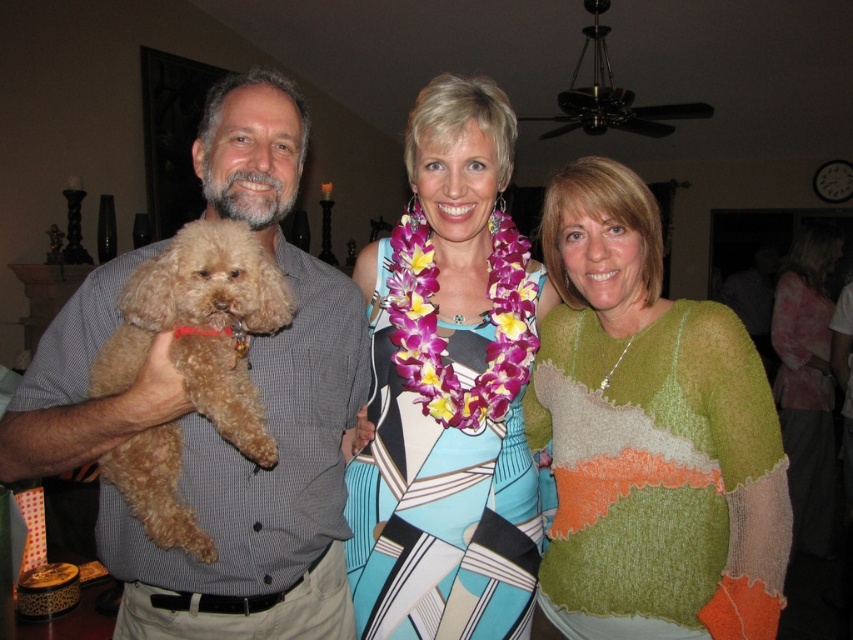
Which object is positioned to the right of the other? The knitted green sweater at right or the printed fabric dress at center?

The knitted green sweater at right is positioned to the right of the printed fabric dress at center.

You are a fashion designer observing the printed fabric dress at center and the light brown fur at center. Which of these two items has a larger surface area?

The printed fabric dress at center has a larger surface area than the light brown fur at center.

You are trying to decide which green sweater to take for a casual day out. The knitted green sweater at right and the green textured sweater at center are both options. Which one is more accessible to you if you are standing in front of them?

The knitted green sweater at right is closer to the viewer, so it is more accessible than the green textured sweater at center.